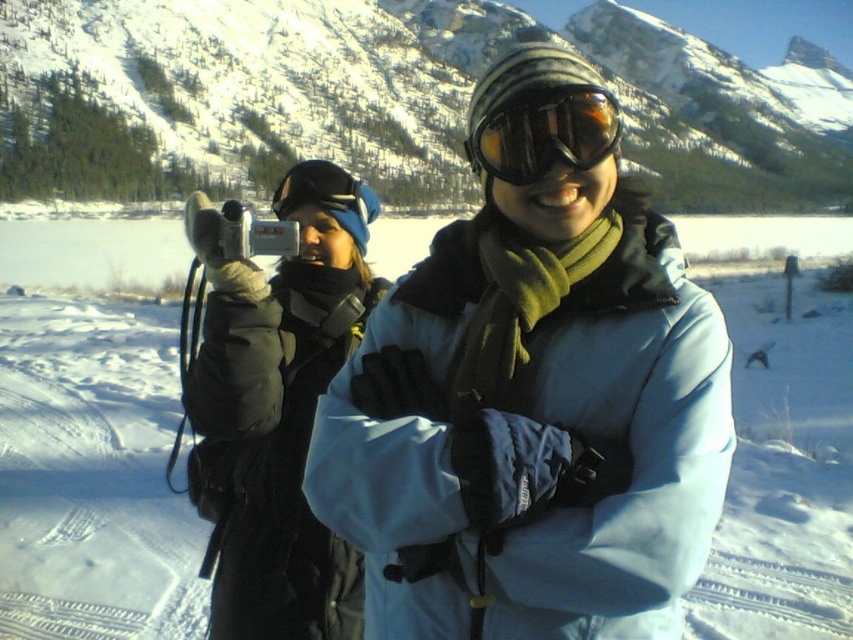
You are organizing a winter clothing sale and need to display the blue matte jacket at center and the matte gray jacket at center on a mannequin. Which jacket should you choose for the main display if you want to showcase the larger one?

The blue matte jacket at center has a larger size compared to the matte gray jacket at center, so it should be chosen for the main display to showcase the larger one.

You are a photographer trying to capture a clear shot of the blue matte jacket at center in this snowy scene. Based on the coordinates provided, where should you position your camera to ensure the jacket is centered in your frame?

The blue matte jacket at center is located at coordinates point (532, 422), so positioning the camera at those coordinates will center the jacket in the frame.

From the picture: You are a fashion designer observing the snowy scene. You need to decide which item from the blue matte jacket at center and the matte black goggles at center would be more suitable for a winter fashion catalog. Considering their sizes, which one should you choose?

The blue matte jacket at center has a larger size compared to the matte black goggles at center, so it would be more suitable for a winter fashion catalog as larger items typically make a stronger visual impact in such contexts.